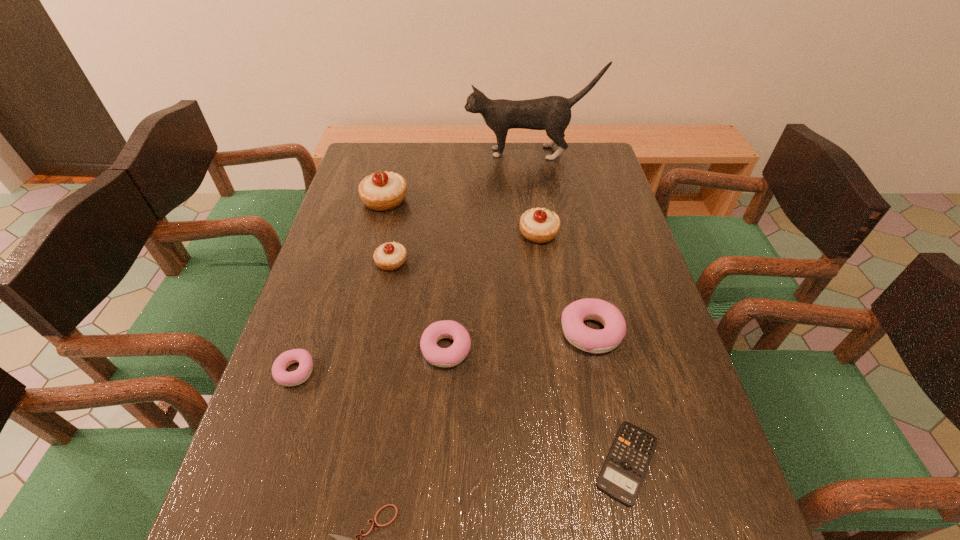
This screenshot has height=540, width=960. Find the location of `the second pink pastry from right to left`. the second pink pastry from right to left is located at coordinates (441, 357).

Where is `the fifth tallest pastry`? the fifth tallest pastry is located at coordinates (441, 357).

Image resolution: width=960 pixels, height=540 pixels. Identify the location of the leftmost pink pastry. (302, 373).

The width and height of the screenshot is (960, 540). I want to click on the smallest pink pastry, so click(302, 373).

I want to click on the second shortest object, so click(623, 472).

Image resolution: width=960 pixels, height=540 pixels. I want to click on vacant region located 0.240m at the face of the farthest object, so click(x=399, y=153).

This screenshot has width=960, height=540. Identify the location of vacant space located 0.130m at the face of the farthest object. (430, 153).

Where is `vacant point located 0.090m at the face of the farthest object`? The width and height of the screenshot is (960, 540). vacant point located 0.090m at the face of the farthest object is located at coordinates (441, 153).

Find the location of a particular element. The image size is (960, 540). vacant position located on the front of the farthest pastry is located at coordinates (367, 275).

Locate an element on the screen. The height and width of the screenshot is (540, 960). vacant area situated 0.400m on the front of the seventh shortest object is located at coordinates (558, 368).